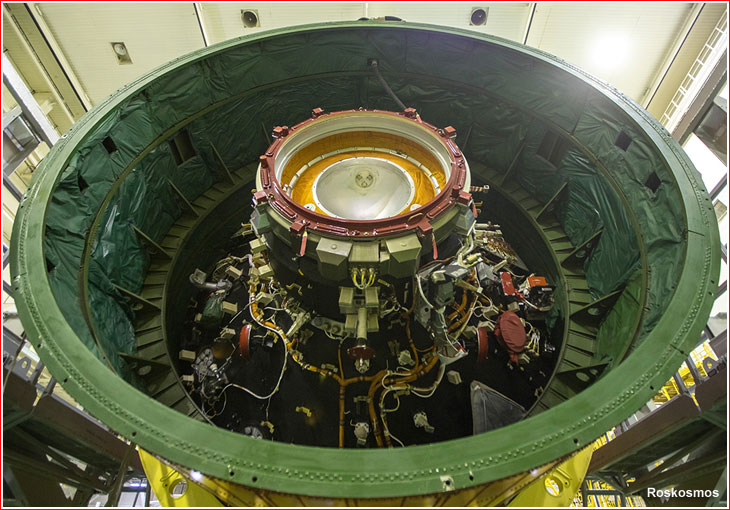
Find the location of a particular element. The height and width of the screenshot is (510, 730). fan outlets is located at coordinates (253, 15), (482, 15).